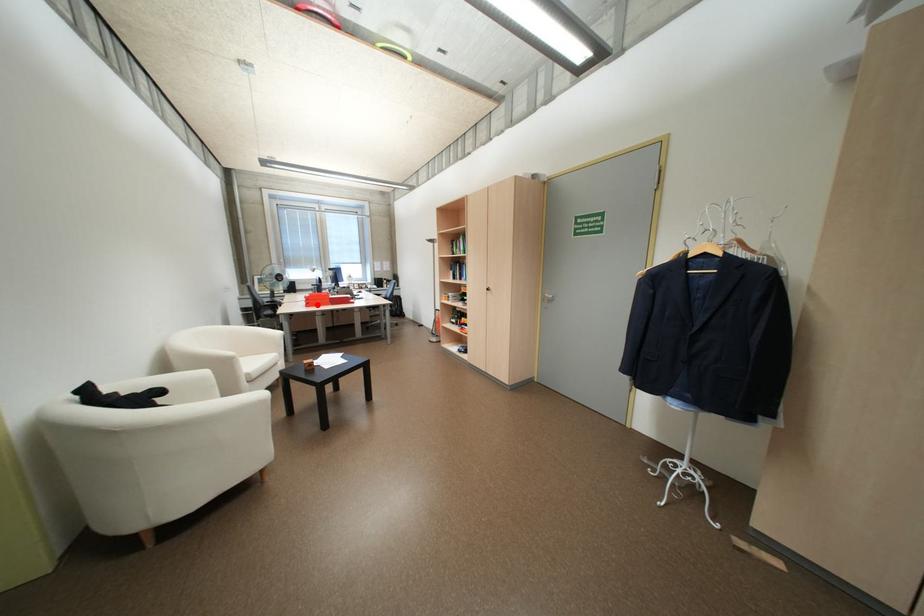
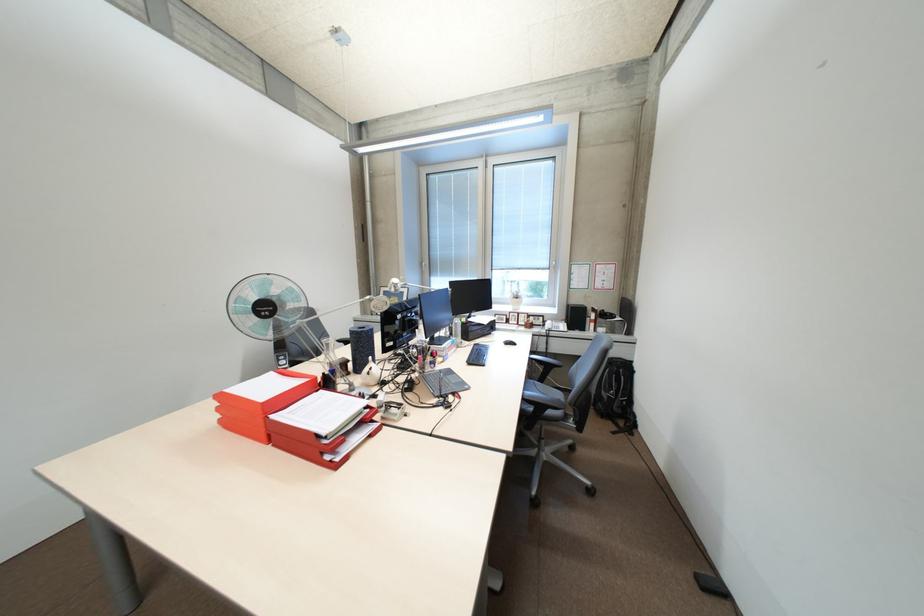
Question: I am providing you with two images of the same scene from different viewpoints. Image1 has a red point marked. In image2, the corresponding 3D location appears at what relative position? Reply with the corresponding letter.

Choices:
 (A) Closer
 (B) Farther

Answer: (B)